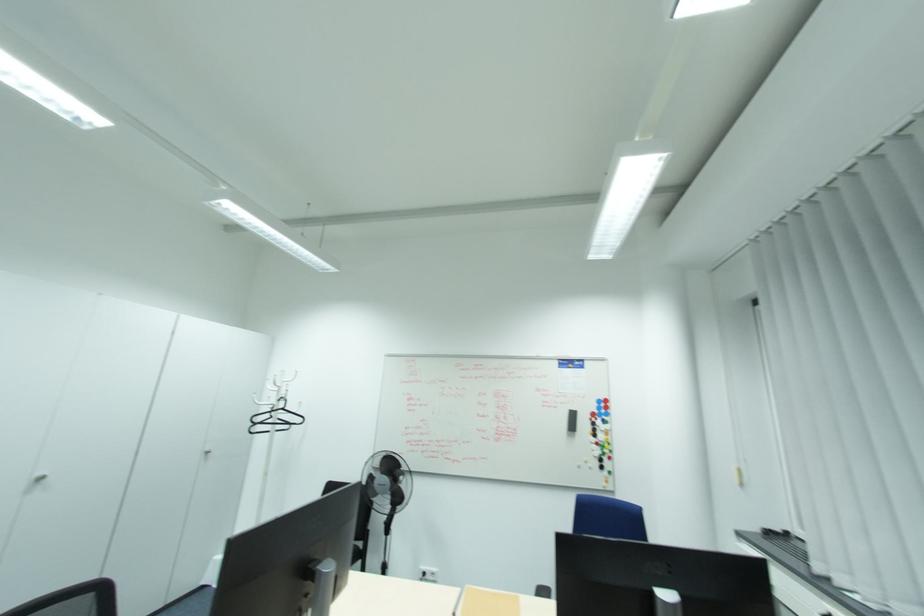
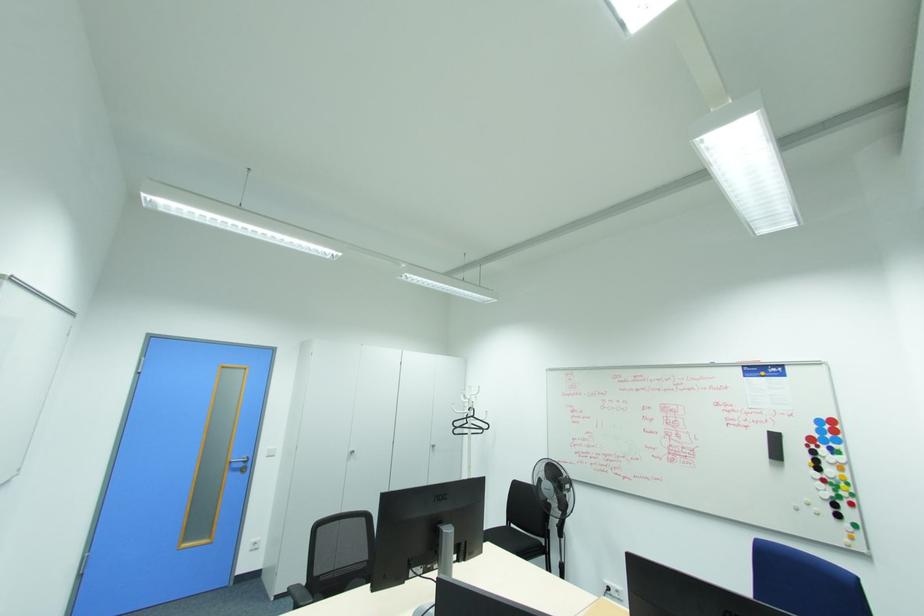
Question: The first image is from the beginning of the video and the second image is from the end. How did the camera likely rotate when shooting the video?

Choices:
 (A) Left
 (B) Right
 (C) Up
 (D) Down

Answer: (A)